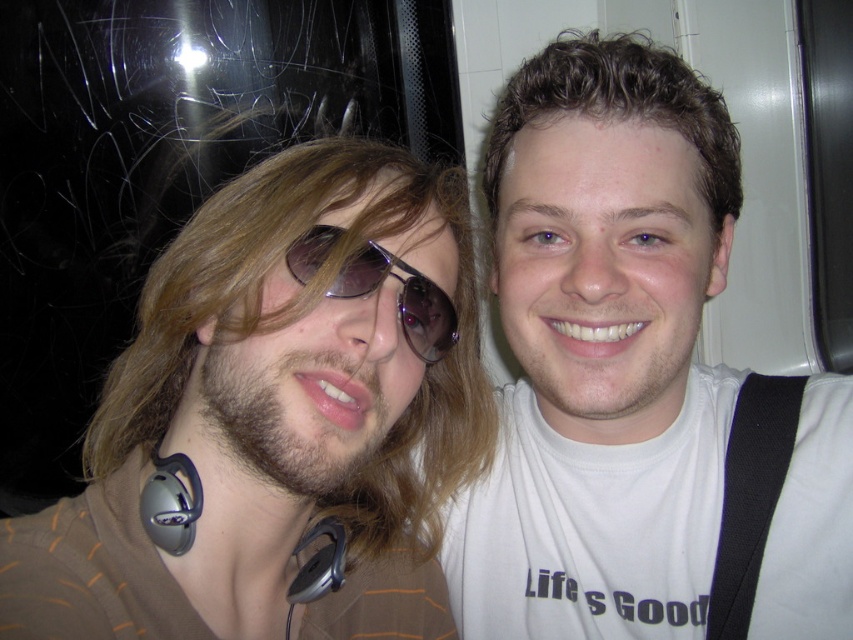
From the picture: Does white matte t-shirt at center appear on the left side of satin silver earphone at lower left?

In fact, white matte t-shirt at center is to the right of satin silver earphone at lower left.

Is white matte t-shirt at center below satin silver earphone at lower left?

Actually, white matte t-shirt at center is above satin silver earphone at lower left.

Measure the distance between white matte t-shirt at center and camera.

They are 60.27 centimeters apart.

This screenshot has height=640, width=853. I want to click on white matte t-shirt at center, so click(601, 352).

Which of these two, sunglasses at center or gray matte earphone at lower left, stands taller?

sunglasses at center

Who is more forward, (311, 248) or (293, 604)?

Point (311, 248)

Describe the element at coordinates (402, 300) in the screenshot. The image size is (853, 640). I see `sunglasses at center` at that location.

This screenshot has width=853, height=640. Find the location of `sunglasses at center`. sunglasses at center is located at coordinates (402, 300).

Between brown matte hair at left and gray matte earphone at lower left, which one appears on the left side from the viewer's perspective?

From the viewer's perspective, brown matte hair at left appears more on the left side.

Identify the location of brown matte hair at left. (277, 413).